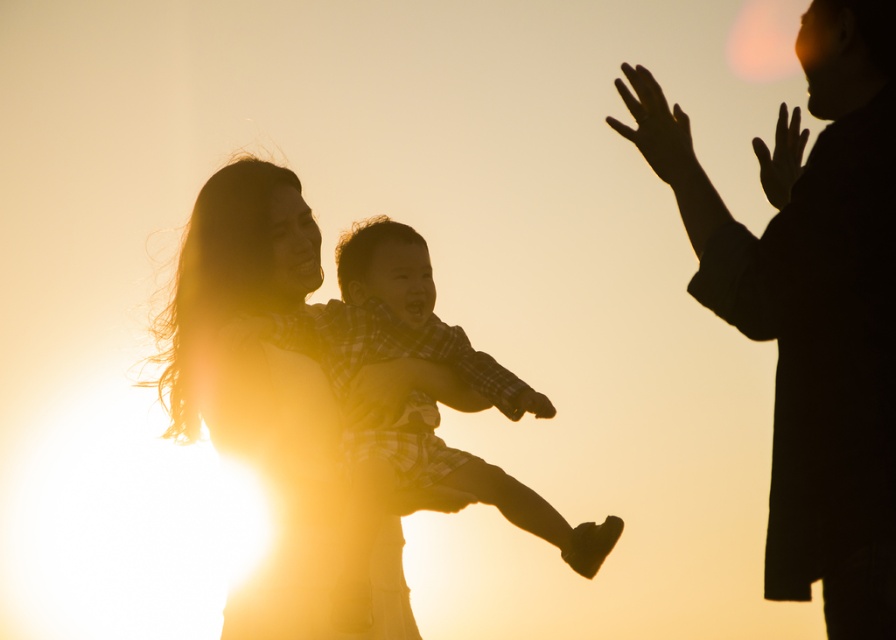
Who is positioned more to the right, silhouette dress at center or silky skin hand at upper right?

Positioned to the right is silky skin hand at upper right.

Does silhouette dress at center have a lesser height compared to silky skin hand at upper right?

No, silhouette dress at center is not shorter than silky skin hand at upper right.

At what (x,y) coordinates should I click in order to perform the action: click on silhouette dress at center. Please return your answer as a coordinate pair (x, y). The height and width of the screenshot is (640, 896). Looking at the image, I should click on (269, 420).

Measure the distance between black matte coat at right and black matte hand at upper right.

1.04 meters

Can you confirm if black matte coat at right is positioned to the left of black matte hand at upper right?

Correct, you'll find black matte coat at right to the left of black matte hand at upper right.

Is point (863, 100) closer to camera compared to point (777, 179)?

Yes, point (863, 100) is closer to viewer.

The image size is (896, 640). In order to click on black matte coat at right in this screenshot , I will do `click(813, 310)`.

Does black matte coat at right appear under silhouette dress at center?

No, black matte coat at right is not below silhouette dress at center.

This screenshot has width=896, height=640. Describe the element at coordinates (813, 310) in the screenshot. I see `black matte coat at right` at that location.

Who is more distant from viewer, (759,243) or (216,316)?

The point (216,316) is more distant.

Identify the location of black matte coat at right. (813, 310).